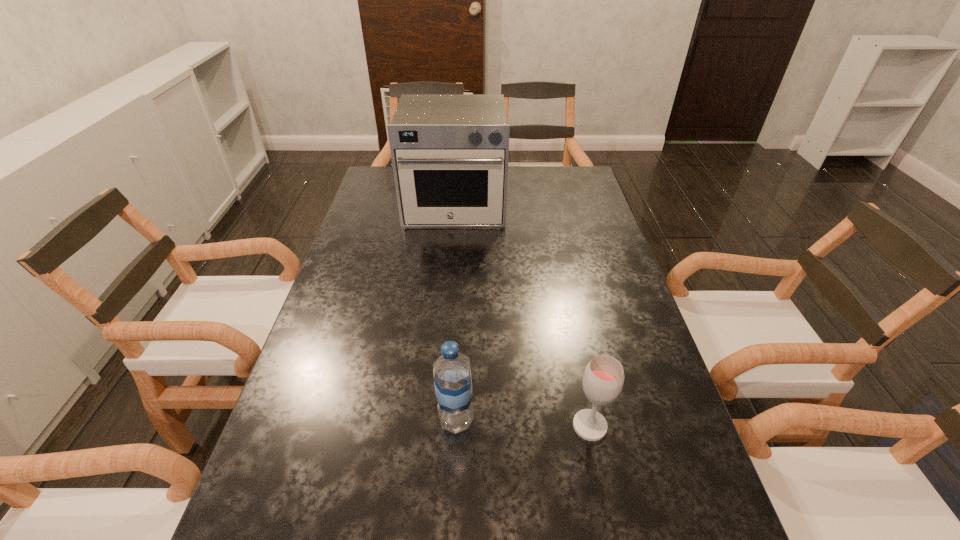
This screenshot has width=960, height=540. What are the coordinates of `the farthest object` in the screenshot? It's located at (449, 152).

In order to click on the tallest object in this screenshot , I will do `click(449, 152)`.

The image size is (960, 540). In order to click on water bottle in this screenshot , I will do `click(452, 376)`.

Where is `the rightmost object`? This screenshot has height=540, width=960. the rightmost object is located at coordinates (603, 378).

The height and width of the screenshot is (540, 960). What are the coordinates of `the shortest object` in the screenshot? It's located at (603, 378).

Find the location of a particular element. The image size is (960, 540). vacant space located 0.110m on the front panel of the toaster oven is located at coordinates (451, 252).

Find the location of `vacant region located 0.200m on the label of the second shortest object`. vacant region located 0.200m on the label of the second shortest object is located at coordinates (572, 420).

I want to click on vacant position located on the right of the shortest object, so click(x=637, y=426).

Image resolution: width=960 pixels, height=540 pixels. I want to click on object present at the far edge, so click(449, 152).

This screenshot has height=540, width=960. What are the coordinates of `object present at the left edge` in the screenshot? It's located at (449, 152).